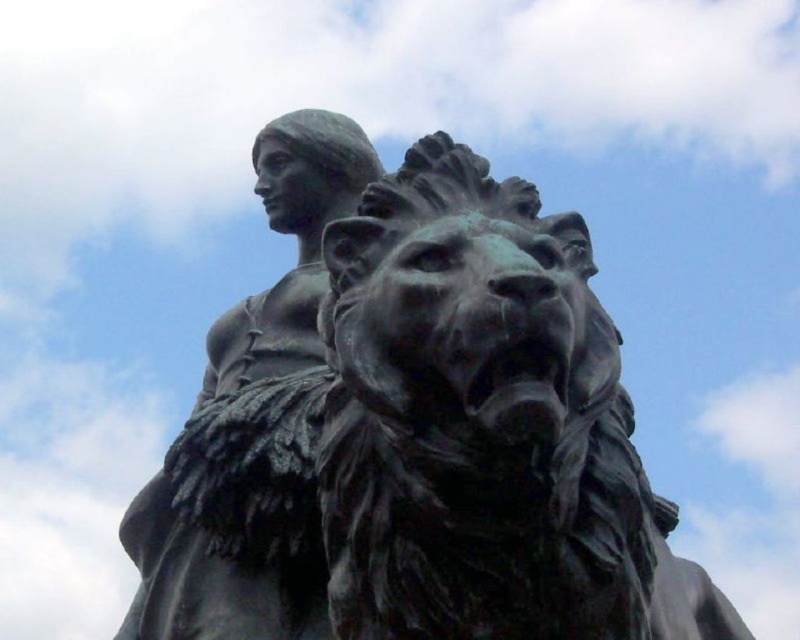
You are an art conservator examining the bronze statue at center and the matte bronze statue at upper left. Based on their positions in the image, which one is situated lower in the frame?

The bronze statue at center is situated lower in the frame as it is located below the matte bronze statue at upper left.

You are an art student analyzing the composition of the image. You observe the bronze statue at center and the matte bronze statue at upper left. Which one do you think is bigger in size?

The bronze statue at center is larger in size than the matte bronze statue at upper left.